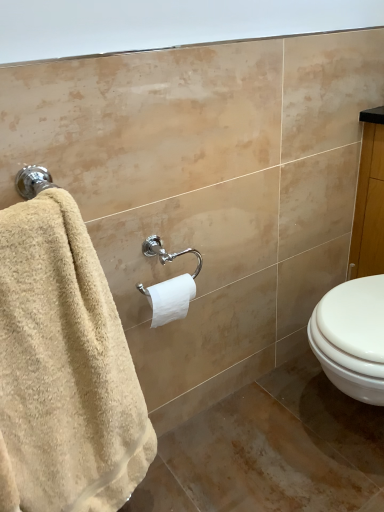
This screenshot has height=512, width=384. What are the coordinates of `beige terry cloth towel at left` in the screenshot? It's located at (64, 368).

Describe the element at coordinates (64, 368) in the screenshot. I see `beige terry cloth towel at left` at that location.

What do you see at coordinates (171, 298) in the screenshot? The image size is (384, 512). I see `white matte toilet paper at center` at bounding box center [171, 298].

This screenshot has height=512, width=384. In order to click on white matte toilet paper at center in this screenshot , I will do `click(171, 298)`.

You are a GUI agent. You are given a task and a screenshot of the screen. Output one action in this format:
    pyautogui.click(x=<x>, y=<y>)
    Task: Click on the beige terry cloth towel at left
    This screenshot has width=384, height=512.
    Given the screenshot: What is the action you would take?
    coord(64,368)

Considering the relative positions of white matte toilet paper at center and beige terry cloth towel at left in the image provided, is white matte toilet paper at center to the right of beige terry cloth towel at left from the viewer's perspective?

Yes.

Based on the photo, between white matte toilet paper at center and beige terry cloth towel at left, which one is positioned behind?

white matte toilet paper at center is further away from the camera.

Considering the positions of points (182, 279) and (144, 408), is point (182, 279) closer to camera compared to point (144, 408)?

No, (182, 279) is further to viewer.

From the image's perspective, would you say white matte toilet paper at center is shown under beige terry cloth towel at left?

No, from the image's perspective, white matte toilet paper at center is not beneath beige terry cloth towel at left.

From a real-world perspective, which object stands above the other?

white matte toilet paper at center is physically above.

Which of these two, white matte toilet paper at center or beige terry cloth towel at left, is thinner?

white matte toilet paper at center.

Does white matte toilet paper at center have a greater height compared to beige terry cloth towel at left?

Incorrect, the height of white matte toilet paper at center is not larger of that of beige terry cloth towel at left.

Considering the sizes of objects white matte toilet paper at center and beige terry cloth towel at left in the image provided, who is bigger, white matte toilet paper at center or beige terry cloth towel at left?

With larger size is beige terry cloth towel at left.

Is white matte toilet paper at center located outside beige terry cloth towel at left?

Yes, white matte toilet paper at center is located beyond the bounds of beige terry cloth towel at left.

Would you consider white matte toilet paper at center to be distant from beige terry cloth towel at left?

white matte toilet paper at center is near beige terry cloth towel at left, not far away.

Does white matte toilet paper at center turn towards beige terry cloth towel at left?

No, white matte toilet paper at center is not aimed at beige terry cloth towel at left.

Can you tell me how much white matte toilet paper at center and beige terry cloth towel at left differ in facing direction?

The angular difference between white matte toilet paper at center and beige terry cloth towel at left is 4.35 degrees.

At what (x,y) coordinates should I click in order to perform the action: click on toilet paper on the right of beige terry cloth towel at left. Please return your answer as a coordinate pair (x, y). The image size is (384, 512). Looking at the image, I should click on click(x=171, y=298).

In the scene shown: In the image, is beige terry cloth towel at left on the left side or the right side of white matte toilet paper at center?

In the image, beige terry cloth towel at left appears on the left side of white matte toilet paper at center.

Is beige terry cloth towel at left in front of or behind white matte toilet paper at center in the image?

Clearly, beige terry cloth towel at left is in front of white matte toilet paper at center.

Which is nearer, (14, 305) or (179, 296)?

The point (14, 305) is more forward.

From the image's perspective, would you say beige terry cloth towel at left is shown under white matte toilet paper at center?

Indeed, from the image's perspective, beige terry cloth towel at left is shown beneath white matte toilet paper at center.

From a real-world perspective, is beige terry cloth towel at left physically above white matte toilet paper at center?

Incorrect, from a real-world perspective, beige terry cloth towel at left is lower than white matte toilet paper at center.

Is beige terry cloth towel at left wider or thinner than white matte toilet paper at center?

Considering their sizes, beige terry cloth towel at left looks broader than white matte toilet paper at center.

Considering the sizes of objects beige terry cloth towel at left and white matte toilet paper at center in the image provided, who is taller, beige terry cloth towel at left or white matte toilet paper at center?

beige terry cloth towel at left is taller.

Considering the sizes of beige terry cloth towel at left and white matte toilet paper at center in the image, is beige terry cloth towel at left bigger or smaller than white matte toilet paper at center?

In the image, beige terry cloth towel at left appears to be larger than white matte toilet paper at center.

Is beige terry cloth towel at left not inside white matte toilet paper at center?

Yes, beige terry cloth towel at left is not within white matte toilet paper at center.

Are beige terry cloth towel at left and white matte toilet paper at center making contact?

beige terry cloth towel at left is not next to white matte toilet paper at center, and they're not touching.

Is beige terry cloth towel at left looking in the opposite direction of white matte toilet paper at center?

No.

Can you tell me how much beige terry cloth towel at left and white matte toilet paper at center differ in facing direction?

They differ by 4.35 degrees in their facing directions.

Identify the location of towel on the left of white matte toilet paper at center. This screenshot has width=384, height=512. (64, 368).

The image size is (384, 512). Find the location of `toilet paper that appears behind the beige terry cloth towel at left`. toilet paper that appears behind the beige terry cloth towel at left is located at coordinates (171, 298).

Find the location of `towel below the white matte toilet paper at center (from a real-world perspective)`. towel below the white matte toilet paper at center (from a real-world perspective) is located at coordinates (64, 368).